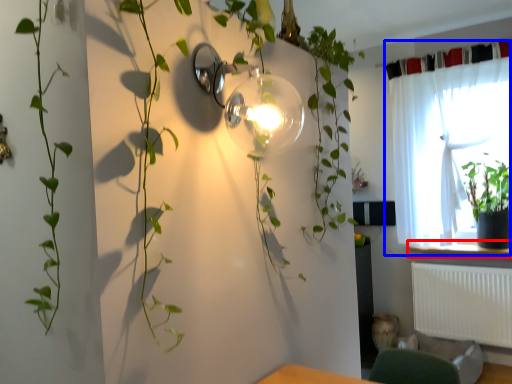
Question: Which object appears farthest to the camera in this image, window sill (highlighted by a red box) or curtain (highlighted by a blue box)?

Choices:
 (A) window sill
 (B) curtain

Answer: (A)